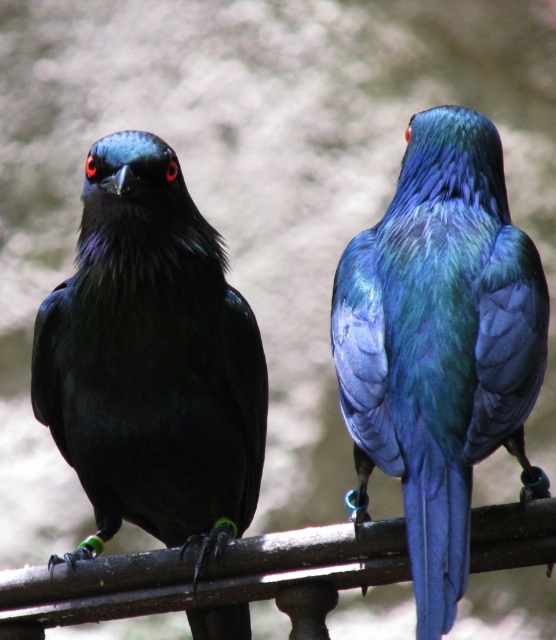
Between shiny black bird at left and metallic blue bird at right, which one is positioned higher?

metallic blue bird at right

Describe the element at coordinates (151, 360) in the screenshot. This screenshot has width=556, height=640. I see `shiny black bird at left` at that location.

Locate an element on the screen. This screenshot has width=556, height=640. shiny black bird at left is located at coordinates (151, 360).